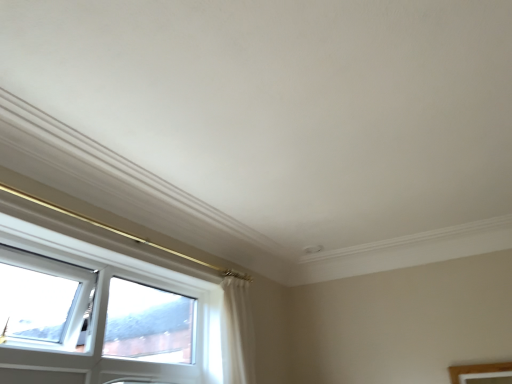
Locate an element on the screen. This screenshot has width=512, height=384. white plastic window at lower left is located at coordinates (113, 316).

Describe the element at coordinates (113, 316) in the screenshot. I see `white plastic window at lower left` at that location.

You are a GUI agent. You are given a task and a screenshot of the screen. Output one action in this format:
    pyautogui.click(x=<x>, y=<y>)
    Task: Click on the white plastic window at lower left
    Image resolution: width=512 pixels, height=384 pixels.
    Given the screenshot: What is the action you would take?
    pyautogui.click(x=113, y=316)